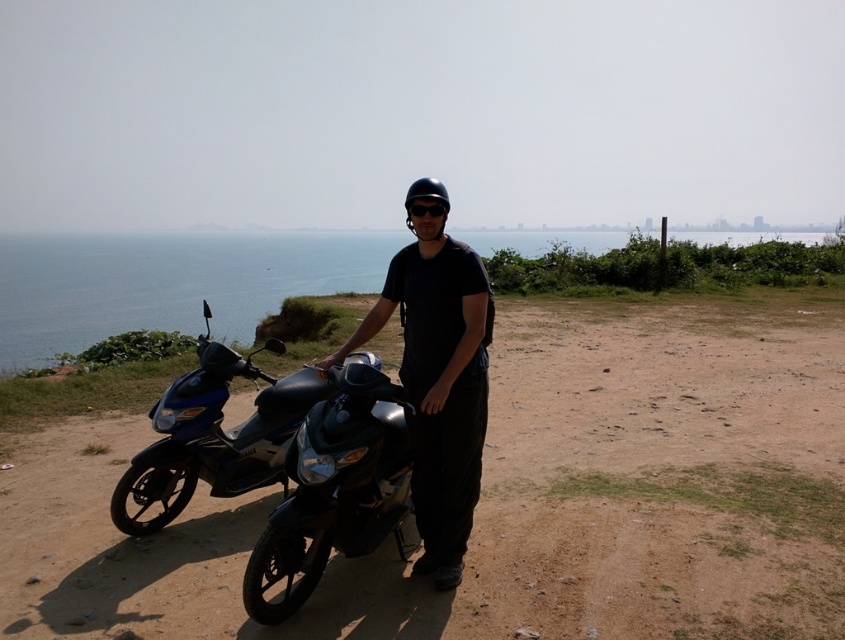
Can you confirm if brown dirt track at center is positioned to the left of blue glossy scooter at left?

Incorrect, brown dirt track at center is not on the left side of blue glossy scooter at left.

Can you confirm if brown dirt track at center is positioned below blue glossy scooter at left?

No.

Image resolution: width=845 pixels, height=640 pixels. What are the coordinates of `brown dirt track at center` in the screenshot? It's located at (511, 497).

Between black matte shirt at center and blue glossy scooter at left, which one appears on the right side from the viewer's perspective?

black matte shirt at center

Which of these two, black matte shirt at center or blue glossy scooter at left, stands shorter?

blue glossy scooter at left is shorter.

You are a GUI agent. You are given a task and a screenshot of the screen. Output one action in this format:
    pyautogui.click(x=<x>, y=<y>)
    Task: Click on the black matte shirt at center
    The height and width of the screenshot is (640, 845).
    Given the screenshot: What is the action you would take?
    pyautogui.click(x=439, y=374)

Where is `black matte shirt at center`? Image resolution: width=845 pixels, height=640 pixels. black matte shirt at center is located at coordinates (439, 374).

What do you see at coordinates (511, 497) in the screenshot?
I see `brown dirt track at center` at bounding box center [511, 497].

Who is more forward, [36,529] or [505,234]?

Point [36,529]

Is point (532, 499) behind point (69, 337)?

No, (532, 499) is closer to viewer.

Where is `brown dirt track at center`? brown dirt track at center is located at coordinates (511, 497).